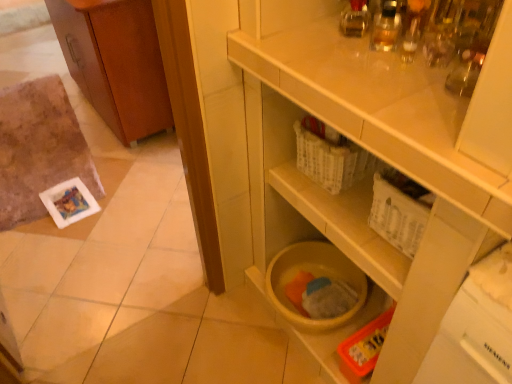
Question: Is white plastic drawer at upper right far away from wooden cabinet at left?

Choices:
 (A) yes
 (B) no

Answer: (A)

Question: From a real-world perspective, is white plastic drawer at upper right physically below wooden cabinet at left?

Choices:
 (A) no
 (B) yes

Answer: (A)

Question: Is white plastic drawer at upper right at the left side of wooden cabinet at left?

Choices:
 (A) yes
 (B) no

Answer: (B)

Question: From the image's perspective, is white plastic drawer at upper right on top of wooden cabinet at left?

Choices:
 (A) yes
 (B) no

Answer: (B)

Question: Could you tell me if white plastic drawer at upper right is turned towards wooden cabinet at left?

Choices:
 (A) yes
 (B) no

Answer: (B)

Question: Considering the positions of wooden cabinet at left and yellow matte plastic bucket at lower center in the image, is wooden cabinet at left wider or thinner than yellow matte plastic bucket at lower center?

Choices:
 (A) wide
 (B) thin

Answer: (B)

Question: Considering the positions of wooden cabinet at left and yellow matte plastic bucket at lower center in the image, is wooden cabinet at left taller or shorter than yellow matte plastic bucket at lower center?

Choices:
 (A) tall
 (B) short

Answer: (B)

Question: Choose the correct answer: Is wooden cabinet at left inside yellow matte plastic bucket at lower center or outside it?

Choices:
 (A) outside
 (B) inside

Answer: (A)

Question: From a real-world perspective, relative to yellow matte plastic bucket at lower center, is wooden cabinet at left vertically above or below?

Choices:
 (A) above
 (B) below

Answer: (B)

Question: From their relative heights in the image, would you say yellow matte plastic bucket at lower center is taller or shorter than white plastic drawer at upper right?

Choices:
 (A) tall
 (B) short

Answer: (A)

Question: In terms of width, does yellow matte plastic bucket at lower center look wider or thinner when compared to white plastic drawer at upper right?

Choices:
 (A) wide
 (B) thin

Answer: (A)

Question: From a real-world perspective, is yellow matte plastic bucket at lower center positioned above or below white plastic drawer at upper right?

Choices:
 (A) below
 (B) above

Answer: (A)

Question: Considering their positions, is yellow matte plastic bucket at lower center located in front of or behind white plastic drawer at upper right?

Choices:
 (A) behind
 (B) front

Answer: (B)

Question: From the image's perspective, is yellow matte plastic bucket at lower center positioned above or below wooden cabinet at left?

Choices:
 (A) below
 (B) above

Answer: (A)

Question: In the image, is yellow matte plastic bucket at lower center positioned in front of or behind wooden cabinet at left?

Choices:
 (A) behind
 (B) front

Answer: (B)